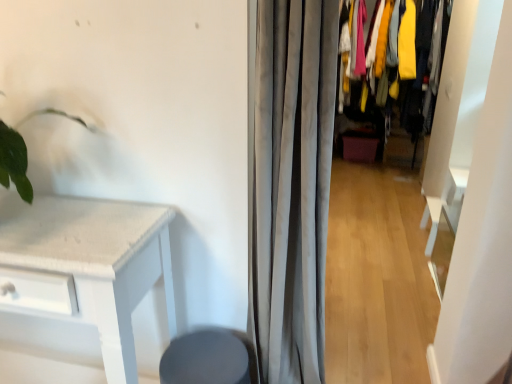
Question: Considering the relative positions of textured fabric closet at center and gray fabric curtain at center in the image provided, is textured fabric closet at center behind gray fabric curtain at center?

Choices:
 (A) no
 (B) yes

Answer: (B)

Question: Can you see textured fabric closet at center touching gray fabric curtain at center?

Choices:
 (A) yes
 (B) no

Answer: (B)

Question: Considering the relative sizes of textured fabric closet at center and gray fabric curtain at center in the image provided, is textured fabric closet at center thinner than gray fabric curtain at center?

Choices:
 (A) yes
 (B) no

Answer: (B)

Question: Can you confirm if textured fabric closet at center is taller than gray fabric curtain at center?

Choices:
 (A) yes
 (B) no

Answer: (A)

Question: Does textured fabric closet at center appear on the right side of gray fabric curtain at center?

Choices:
 (A) no
 (B) yes

Answer: (B)

Question: From the image's perspective, is textured fabric closet at center positioned above or below gray fabric curtain at center?

Choices:
 (A) below
 (B) above

Answer: (B)

Question: Visually, is textured fabric closet at center positioned to the left or to the right of gray fabric curtain at center?

Choices:
 (A) left
 (B) right

Answer: (B)

Question: Is textured fabric closet at center inside or outside of gray fabric curtain at center?

Choices:
 (A) inside
 (B) outside

Answer: (B)

Question: From a real-world perspective, is textured fabric closet at center positioned above or below gray fabric curtain at center?

Choices:
 (A) below
 (B) above

Answer: (B)

Question: Considering the positions of textured fabric closet at center and matte gray swivel chair at lower center in the image, is textured fabric closet at center bigger or smaller than matte gray swivel chair at lower center?

Choices:
 (A) small
 (B) big

Answer: (B)

Question: Considering the positions of point (422, 46) and point (177, 349), is point (422, 46) closer or farther from the camera than point (177, 349)?

Choices:
 (A) farther
 (B) closer

Answer: (A)

Question: Is textured fabric closet at center inside the boundaries of matte gray swivel chair at lower center, or outside?

Choices:
 (A) inside
 (B) outside

Answer: (B)

Question: From the image's perspective, relative to matte gray swivel chair at lower center, is textured fabric closet at center above or below?

Choices:
 (A) above
 (B) below

Answer: (A)

Question: Is point (217, 355) positioned closer to the camera than point (442, 26)?

Choices:
 (A) closer
 (B) farther

Answer: (A)

Question: In terms of width, does matte gray swivel chair at lower center look wider or thinner when compared to textured fabric closet at center?

Choices:
 (A) thin
 (B) wide

Answer: (A)